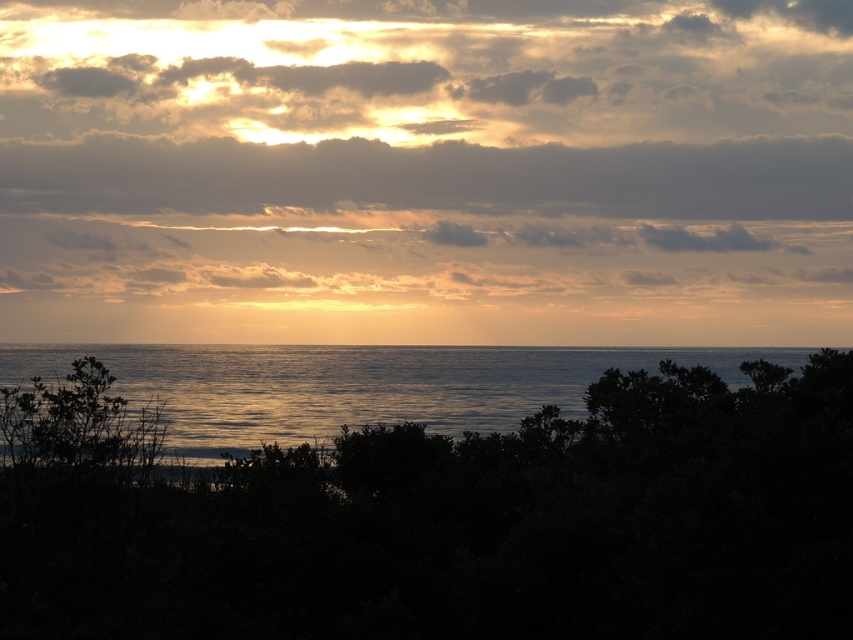
Question: Is dark gray cloud at upper center below glistening water at center?

Choices:
 (A) no
 (B) yes

Answer: (A)

Question: Which object is farther from the camera taking this photo?

Choices:
 (A) green leafy tree at center
 (B) glistening water at center
 (C) cloudy sky at upper center
 (D) dark gray cloud at upper center

Answer: (D)

Question: Estimate the real-world distances between objects in this image. Which object is farther from the cloudy sky at upper center?

Choices:
 (A) green leafy tree at center
 (B) glistening water at center

Answer: (A)

Question: Based on their relative distances, which object is farther from the cloudy sky at upper center?

Choices:
 (A) glistening water at center
 (B) green leafy tree at center

Answer: (B)

Question: Does green leafy tree at center have a larger size compared to glistening water at center?

Choices:
 (A) no
 (B) yes

Answer: (A)

Question: Is cloudy sky at upper center wider than dark gray cloud at upper center?

Choices:
 (A) no
 (B) yes

Answer: (B)